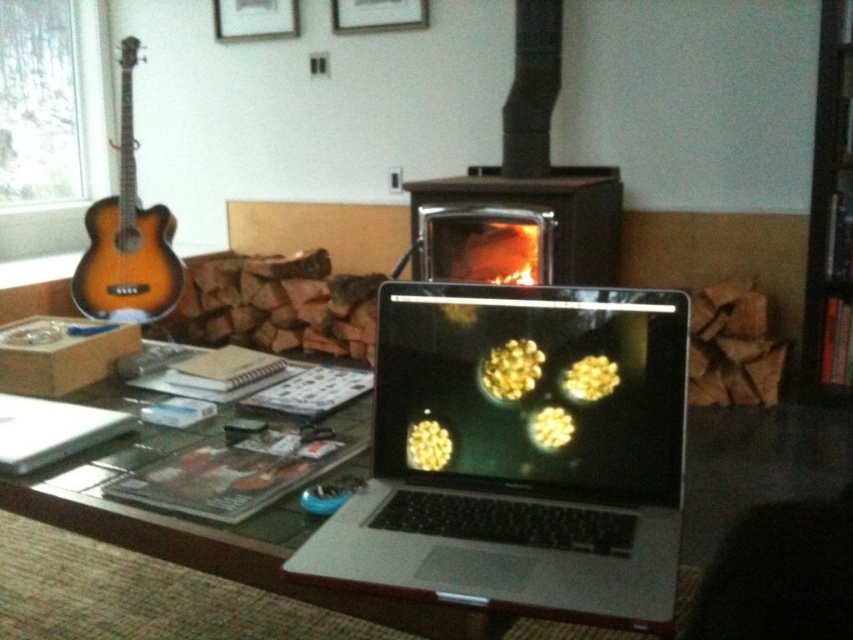
From the picture: Which is below, silver metallic laptop at center or black matte fireplace at center?

Positioned lower is silver metallic laptop at center.

Consider the image. Can you confirm if silver metallic laptop at center is bigger than black matte fireplace at center?

No.

Is point (465, 570) in front of point (589, 236)?

Yes, point (465, 570) is closer to viewer.

This screenshot has width=853, height=640. Identify the location of silver metallic laptop at center. (520, 454).

Does point (844, 380) come behind point (294, 36)?

No, it is in front of (294, 36).

Identify the location of black wood bookshelf at upper right. The height and width of the screenshot is (640, 853). (830, 216).

Looking at this image, can you confirm if glass/matte table at center is taller than black matte fireplace at center?

Incorrect, glass/matte table at center's height is not larger of black matte fireplace at center's.

Is point (131, 508) closer to camera compared to point (491, 234)?

Yes, it is in front of point (491, 234).

This screenshot has width=853, height=640. I want to click on glass/matte table at center, so click(219, 536).